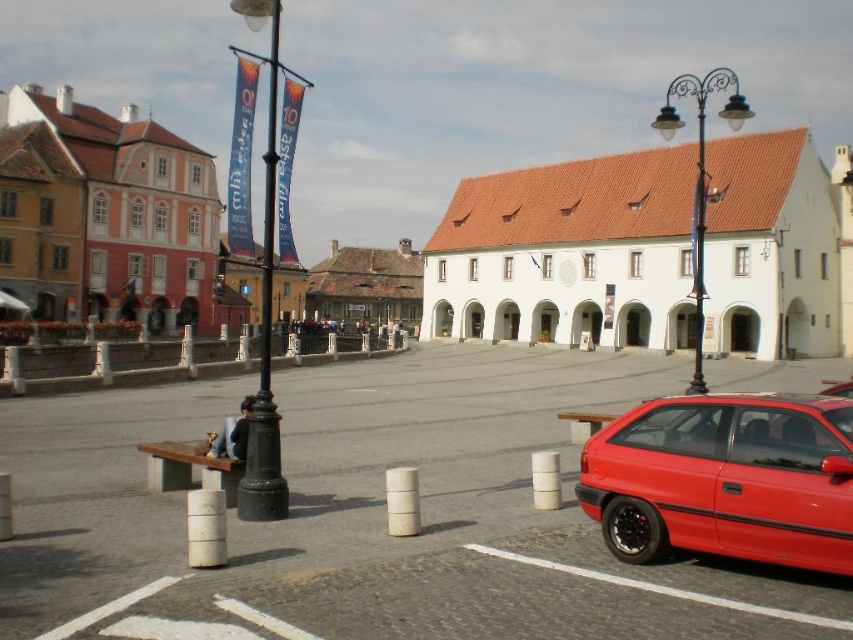
You are standing at the point marked as point (x=450, y=467) in the image. What object are you standing on?

You are standing on the white concrete parking lot at center.

You are a city planner assessing the urban square. You need to determine if the white matte building at center can be seen from the top of the black metal pole at center. Based on their heights, what is your conclusion?

The white matte building at center is shorter than the black metal pole at center, so the building would be visible from the top of the pole since it doesn